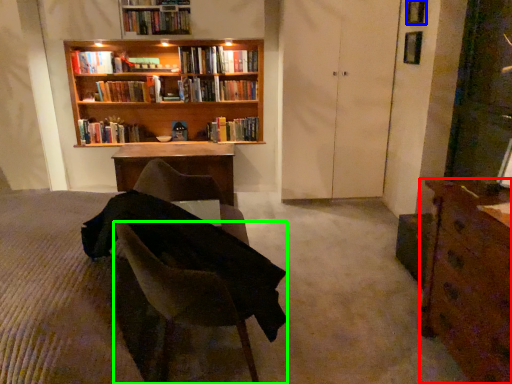
Question: Which object is positioned closest to desk (highlighted by a red box)? Select from window (highlighted by a blue box) and chair (highlighted by a green box).

Choices:
 (A) window
 (B) chair

Answer: (B)